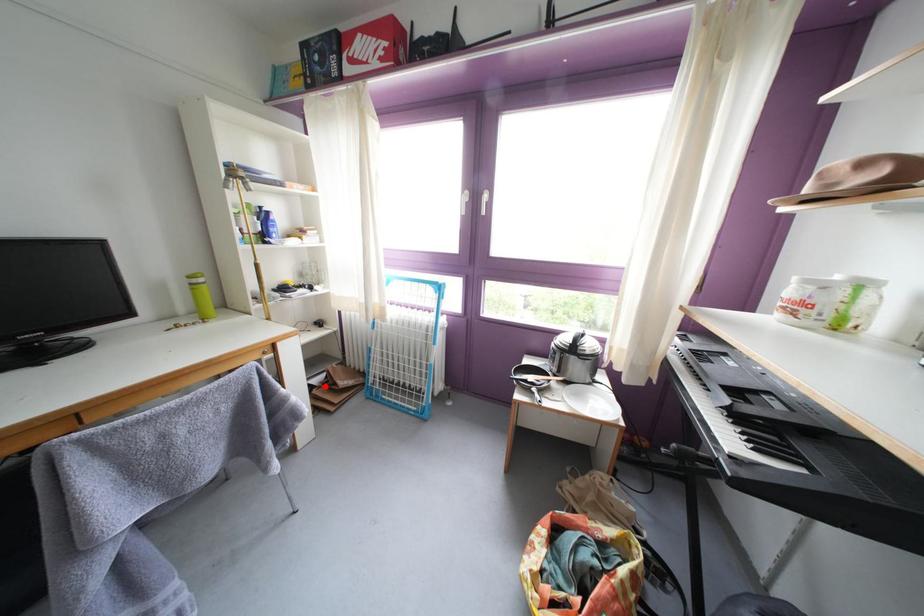
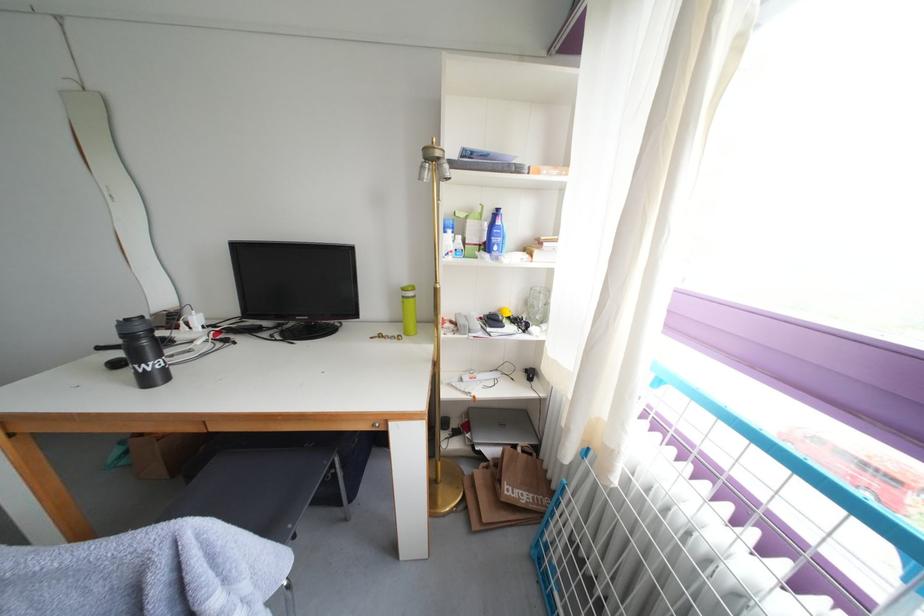
The point at the highlighted location is marked in the first image. Where is the corresponding point in the second image?

(499, 456)